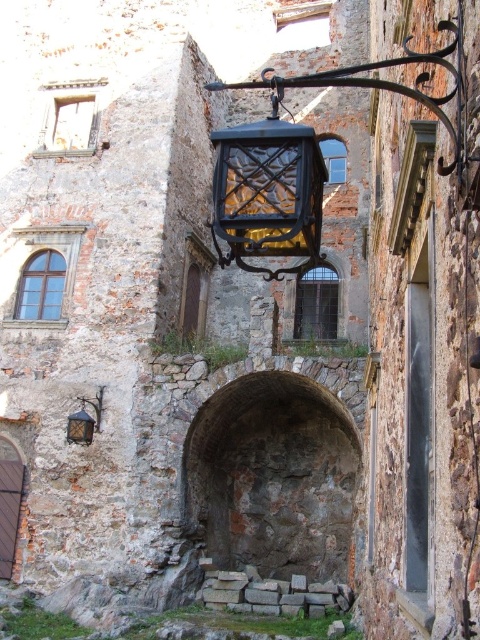
You are an explorer standing in front of the aged stone structure. You see the rustic stone archway at center and the matte black lantern at center. Which object is positioned higher up?

The matte black lantern at center is positioned higher up because the rustic stone archway at center is below it.

You are an architect examining the aged stone structure. You notice a specific point marked at coordinates (275, 477). Based on the scene, where is this point located?

The point at (275, 477) marks the rustic stone archway at center.

You are standing at the entrance of the historical stone structure and notice two points marked on the ground. The first point is labeled as point (257, 460) and the second as point (83, 419). Which point is closer to you as you face the entrance?

Point (83, 419) is closer to you because it is in front of point (257, 460) when facing the entrance.